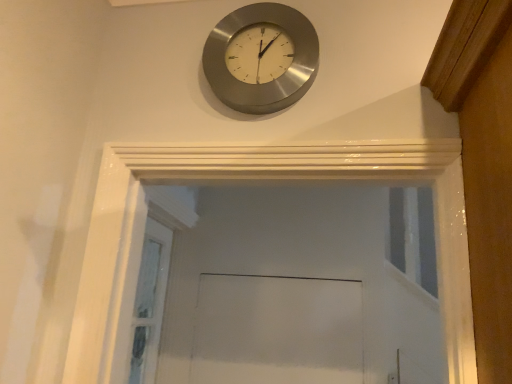
Question: In the image, is satin silver clock at upper center on the left side or the right side of clear glass screen door at lower left?

Choices:
 (A) right
 (B) left

Answer: (A)

Question: Considering the positions of satin silver clock at upper center and clear glass screen door at lower left in the image, is satin silver clock at upper center taller or shorter than clear glass screen door at lower left?

Choices:
 (A) short
 (B) tall

Answer: (A)

Question: Do you think satin silver clock at upper center is within clear glass screen door at lower left, or outside of it?

Choices:
 (A) outside
 (B) inside

Answer: (A)

Question: Is point (165, 256) closer or farther from the camera than point (248, 46)?

Choices:
 (A) closer
 (B) farther

Answer: (B)

Question: Relative to satin silver clock at upper center, is clear glass screen door at lower left in front or behind?

Choices:
 (A) front
 (B) behind

Answer: (B)

Question: Choose the correct answer: Is clear glass screen door at lower left inside satin silver clock at upper center or outside it?

Choices:
 (A) outside
 (B) inside

Answer: (A)

Question: Considering the relative positions of clear glass screen door at lower left and satin silver clock at upper center in the image provided, is clear glass screen door at lower left to the left or to the right of satin silver clock at upper center?

Choices:
 (A) left
 (B) right

Answer: (A)